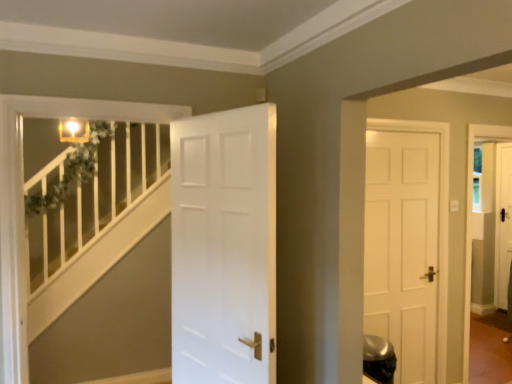
This screenshot has width=512, height=384. Identify the location of white matte door at center. (224, 247).

The width and height of the screenshot is (512, 384). Describe the element at coordinates (224, 247) in the screenshot. I see `white matte door at center` at that location.

You are a GUI agent. You are given a task and a screenshot of the screen. Output one action in this format:
    pyautogui.click(x=<x>, y=<y>)
    Task: Click on the white painted wood balustrade at left
    
    Given the screenshot: What is the action you would take?
    pyautogui.click(x=93, y=194)

What do you see at coordinates (93, 194) in the screenshot?
I see `white painted wood balustrade at left` at bounding box center [93, 194].

Where is `white matte door at center`? The height and width of the screenshot is (384, 512). white matte door at center is located at coordinates (224, 247).

Is white painted wood balustrade at left at the right side of white matte door at center?

No, white painted wood balustrade at left is not to the right of white matte door at center.

Considering the relative positions of white painted wood balustrade at left and white matte door at center in the image provided, is white painted wood balustrade at left behind white matte door at center?

Yes, white painted wood balustrade at left is further from the viewer.

Considering the points (144, 164) and (254, 367), which point is behind, point (144, 164) or point (254, 367)?

Positioned behind is point (144, 164).

From the image's perspective, would you say white painted wood balustrade at left is shown under white matte door at center?

Correct, white painted wood balustrade at left appears lower than white matte door at center in the image.

From a real-world perspective, is white painted wood balustrade at left positioned under white matte door at center based on gravity?

Yes, from a real-world perspective, white painted wood balustrade at left is under white matte door at center.

Considering the sizes of objects white painted wood balustrade at left and white matte door at center in the image provided, who is wider, white painted wood balustrade at left or white matte door at center?

With larger width is white painted wood balustrade at left.

From their relative heights in the image, would you say white painted wood balustrade at left is taller or shorter than white matte door at center?

In the image, white painted wood balustrade at left appears to be shorter than white matte door at center.

Can you confirm if white painted wood balustrade at left is smaller than white matte door at center?

Yes, white painted wood balustrade at left is smaller than white matte door at center.

In the scene shown: Would you say white painted wood balustrade at left contains white matte door at center?

Definitely not — white matte door at center is not inside white painted wood balustrade at left.

Is white painted wood balustrade at left directly adjacent to white matte door at center?

No, white painted wood balustrade at left is not with white matte door at center.

In the scene shown: Is white painted wood balustrade at left oriented away from white matte door at center?

That's not correct — white painted wood balustrade at left is not looking away from white matte door at center.

Where is `door in front of the white painted wood balustrade at left`? door in front of the white painted wood balustrade at left is located at coordinates (224, 247).

Does white matte door at center appear on the left side of white painted wood balustrade at left?

Incorrect, white matte door at center is not on the left side of white painted wood balustrade at left.

Between white matte door at center and white painted wood balustrade at left, which one is positioned behind?

white painted wood balustrade at left.

Which is more distant, (x=272, y=333) or (x=98, y=138)?

Positioned behind is point (x=98, y=138).

From the image's perspective, would you say white matte door at center is positioned over white painted wood balustrade at left?

Correct, white matte door at center appears higher than white painted wood balustrade at left in the image.

From a real-world perspective, does white matte door at center stand above white painted wood balustrade at left?

Correct, in the physical world, white matte door at center is higher than white painted wood balustrade at left.

Considering the sizes of objects white matte door at center and white painted wood balustrade at left in the image provided, who is wider, white matte door at center or white painted wood balustrade at left?

Wider between the two is white painted wood balustrade at left.

In the scene shown: Which of these two, white matte door at center or white painted wood balustrade at left, stands taller?

Standing taller between the two is white matte door at center.

Does white matte door at center have a smaller size compared to white painted wood balustrade at left?

No.

Is white matte door at center not inside white painted wood balustrade at left?

Yes, white matte door at center is located beyond the bounds of white painted wood balustrade at left.

Are white matte door at center and white painted wood balustrade at left making contact?

white matte door at center and white painted wood balustrade at left are clearly separated.

Could you tell me if white matte door at center is turned towards white painted wood balustrade at left?

No, white matte door at center is not oriented towards white painted wood balustrade at left.

How many degrees apart are the facing directions of white matte door at center and white painted wood balustrade at left?

The angular difference between white matte door at center and white painted wood balustrade at left is 74.1 degrees.

The height and width of the screenshot is (384, 512). Identify the location of balustrade beneath the white matte door at center (from a real-world perspective). (x=93, y=194).

Find the location of a particular element. This screenshot has height=384, width=512. door located above the white painted wood balustrade at left (from a real-world perspective) is located at coordinates (224, 247).

Find the location of a particular element. balustrade on the left of white matte door at center is located at coordinates (93, 194).